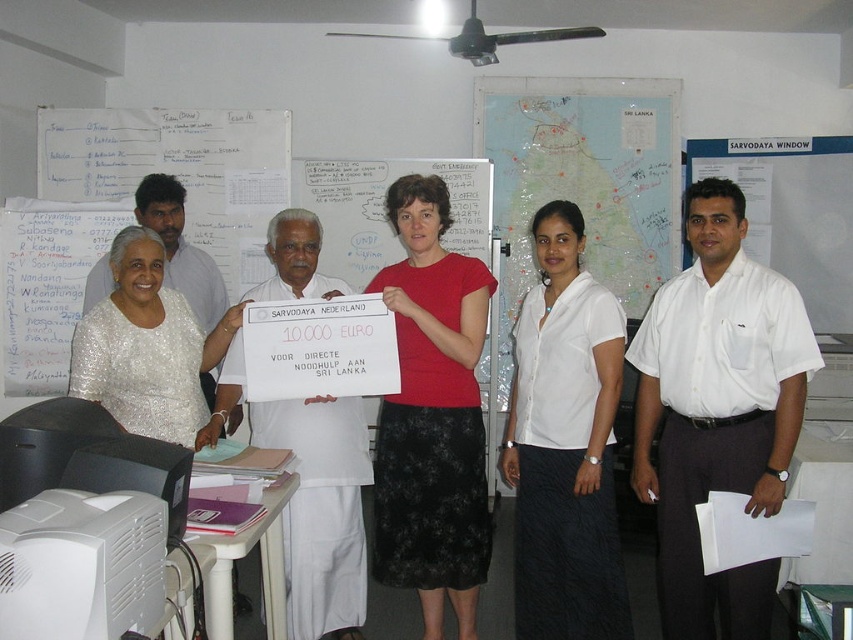
Can you confirm if red matte shirt at center is positioned above white shirt at left?

Actually, red matte shirt at center is below white shirt at left.

Locate an element on the screen. The image size is (853, 640). red matte shirt at center is located at coordinates (432, 416).

This screenshot has width=853, height=640. What do you see at coordinates (717, 412) in the screenshot?
I see `white shirt at center` at bounding box center [717, 412].

Is white shirt at center above white matte shirt at center?

Correct, white shirt at center is located above white matte shirt at center.

Which is in front, point (693, 378) or point (618, 324)?

Point (693, 378) is more forward.

Identify the location of white shirt at center. This screenshot has height=640, width=853. (717, 412).

Between point (618, 538) and point (293, 596), which one is positioned behind?

The point (293, 596) is behind.

Which is above, white matte shirt at center or white cloth at center?

white matte shirt at center is higher up.

Who is more distant from viewer, (x=514, y=477) or (x=296, y=438)?

The point (x=514, y=477) is behind.

Where is `white matte shirt at center`? The image size is (853, 640). white matte shirt at center is located at coordinates (566, 444).